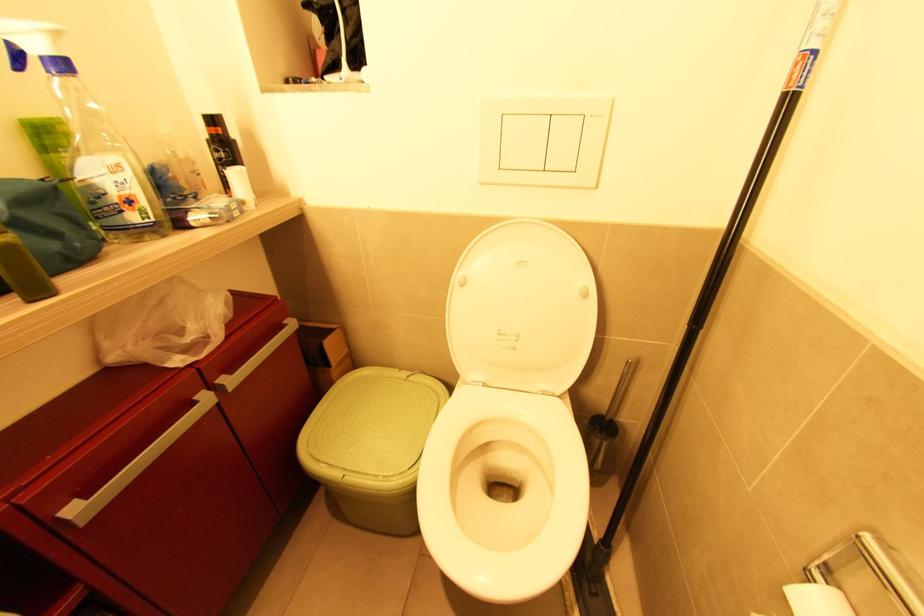
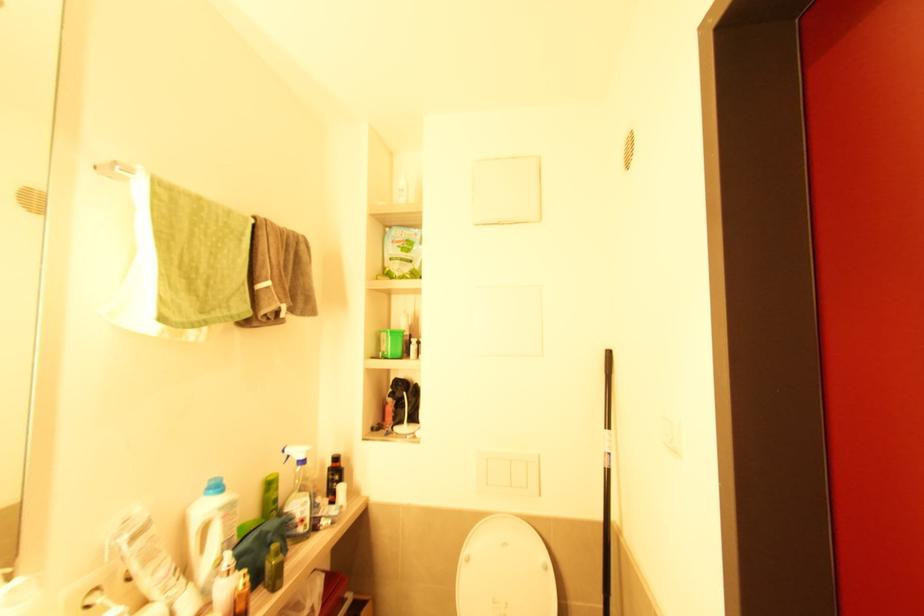
Locate, in the second image, the point that corresponds to point 792,103 in the first image.

(610, 472)